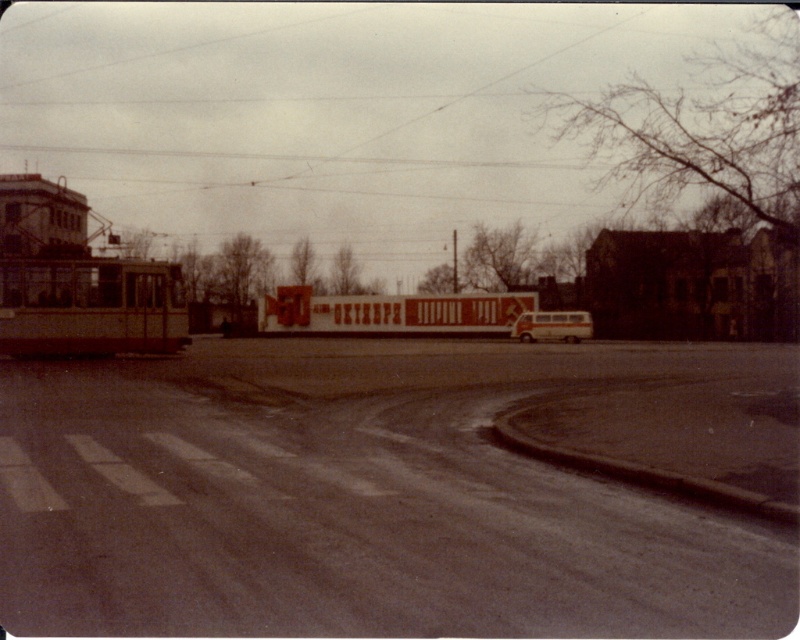
Which is more to the left, metallic silver bus at left or light beige metallic bus at center?

metallic silver bus at left is more to the left.

Does metallic silver bus at left have a lesser width compared to light beige metallic bus at center?

No.

Does point (72, 340) come farther from viewer compared to point (534, 337)?

No, it is in front of (534, 337).

You are a GUI agent. You are given a task and a screenshot of the screen. Output one action in this format:
    pyautogui.click(x=<x>, y=<y>)
    Task: Click on the metallic silver bus at left
    This screenshot has width=800, height=640.
    Given the screenshot: What is the action you would take?
    pyautogui.click(x=90, y=307)